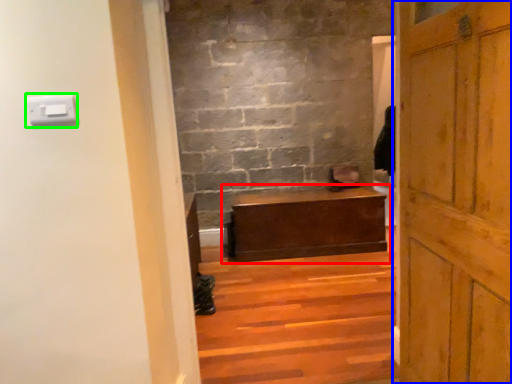
Question: Which object is the closest to the table (highlighted by a red box)? Choose among these: door (highlighted by a blue box) or light switch (highlighted by a green box).

Choices:
 (A) door
 (B) light switch

Answer: (A)